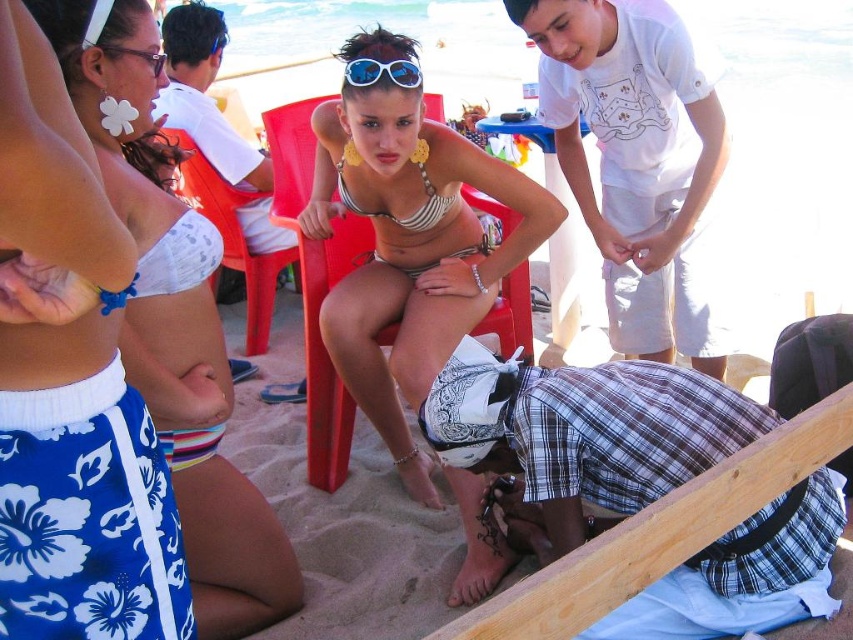
Is white cotton shirt at upper center below plastic red chair at center?

Indeed, white cotton shirt at upper center is positioned under plastic red chair at center.

Which is below, white cotton shirt at upper center or plastic red chair at center?

white cotton shirt at upper center is lower down.

Image resolution: width=853 pixels, height=640 pixels. Identify the location of white cotton shirt at upper center. (635, 161).

Between white floral skirt at lower left and matte silver bikini at center, which one has less height?

white floral skirt at lower left

Does point (56, 83) lie behind point (422, 369)?

No, (56, 83) is in front of (422, 369).

In order to click on white floral skirt at lower left in this screenshot , I will do `click(73, 385)`.

Is matte silver bikini at center in front of clear plastic goggles at upper left?

No, matte silver bikini at center is behind clear plastic goggles at upper left.

Who is more distant from viewer, (402, 172) or (149, 54)?

The point (402, 172) is behind.

The width and height of the screenshot is (853, 640). What are the coordinates of `matte silver bikini at center` in the screenshot? It's located at (410, 250).

Find the location of `matte silver bikini at center`. matte silver bikini at center is located at coordinates (410, 250).